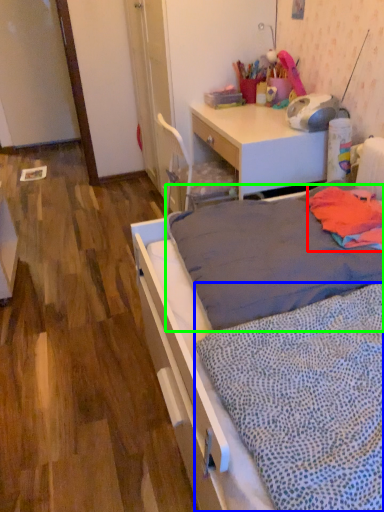
Question: Estimate the real-world distances between objects in this image. Which object is farther from blanket (highlighted by a red box), blanket (highlighted by a blue box) or mattress (highlighted by a green box)?

Choices:
 (A) blanket
 (B) mattress

Answer: (A)